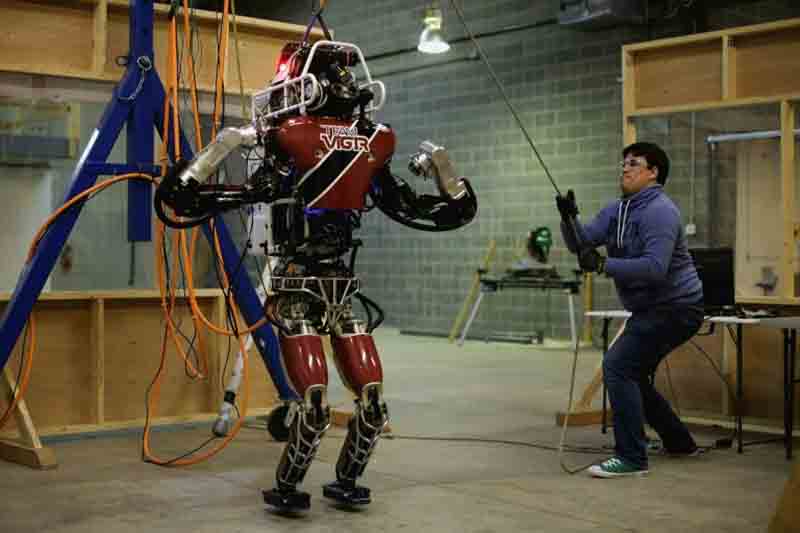
What are the coordinates of `table` in the screenshot? It's located at (488, 284), (786, 324).